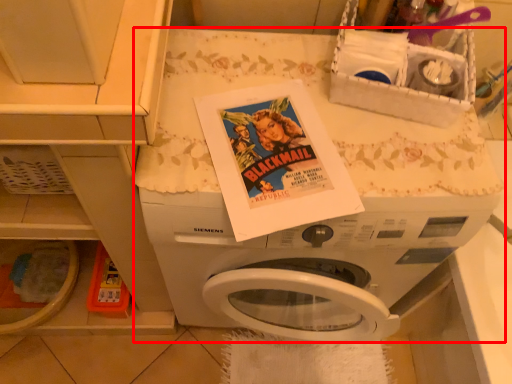
Question: Considering the relative positions of washing machine (annotated by the red box) and basket in the image provided, where is washing machine (annotated by the red box) located with respect to the staircase?

Choices:
 (A) right
 (B) left

Answer: (B)